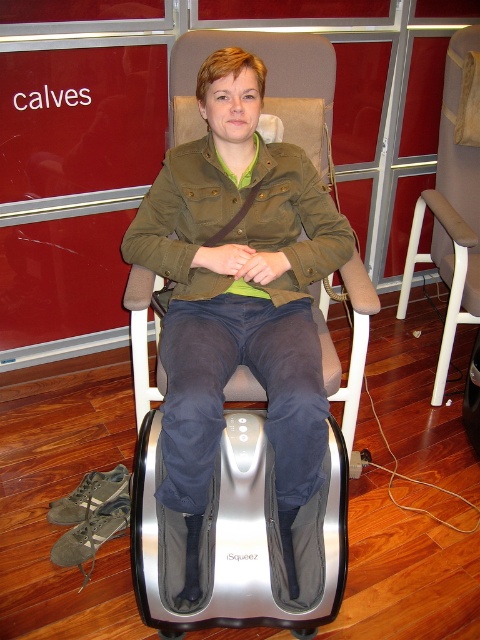
Question: In this image, where is olive green fabric jacket at center located relative to beige fabric swivel chair at center?

Choices:
 (A) right
 (B) left

Answer: (B)

Question: Which of the following is the farthest from the observer?

Choices:
 (A) (451, 204)
 (B) (228, 216)
 (C) (256, 250)

Answer: (A)

Question: Does olive green fabric jacket at center appear on the right side of olive green canvas jacket at center?

Choices:
 (A) yes
 (B) no

Answer: (A)

Question: Among these points, which one is nearest to the camera?

Choices:
 (A) (242, 97)
 (B) (219, 220)

Answer: (A)

Question: Is olive green fabric jacket at center bigger than beige fabric swivel chair at center?

Choices:
 (A) no
 (B) yes

Answer: (B)

Question: Among these points, which one is farthest from the camera?

Choices:
 (A) (132, 246)
 (B) (288, 556)

Answer: (A)